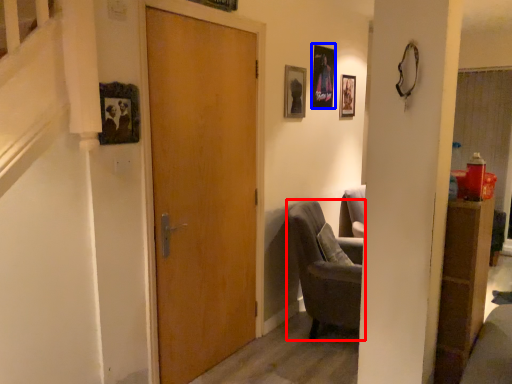
Question: Which object appears farthest to the camera in this image, chair (highlighted by a red box) or picture frame (highlighted by a blue box)?

Choices:
 (A) chair
 (B) picture frame

Answer: (B)